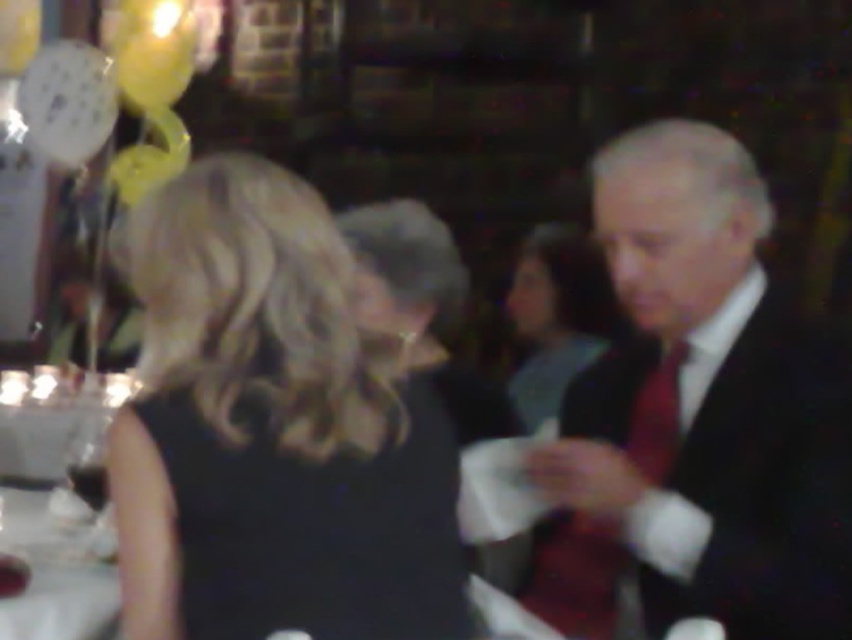
Question: Estimate the real-world distances between objects in this image. Which object is closer to the matte black suit at right?

Choices:
 (A) white glossy table at lower left
 (B) smooth black dress at center
 (C) black silk dress at center

Answer: (C)

Question: Does black silk dress at center have a greater width compared to smooth black dress at center?

Choices:
 (A) yes
 (B) no

Answer: (A)

Question: Is black silk dress at center above matte black suit at right?

Choices:
 (A) yes
 (B) no

Answer: (B)

Question: Which of the following is the farthest from the observer?

Choices:
 (A) white glossy table at lower left
 (B) matte black suit at right
 (C) black silk dress at center

Answer: (B)

Question: Is matte black suit at right positioned behind smooth black dress at center?

Choices:
 (A) yes
 (B) no

Answer: (B)

Question: Which point is farther to the camera?

Choices:
 (A) (66, 589)
 (B) (537, 332)
 (C) (747, 378)
 (D) (302, 244)

Answer: (B)